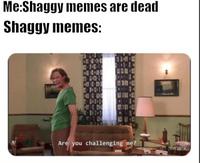
You are a GUI agent. You are given a task and a screenshot of the screen. Output one action in this format:
    pyautogui.click(x=<x>, y=<y>)
    Task: Click on the green bottom half of wall
    
    Given the screenshot: What is the action you would take?
    pyautogui.click(x=34, y=119)